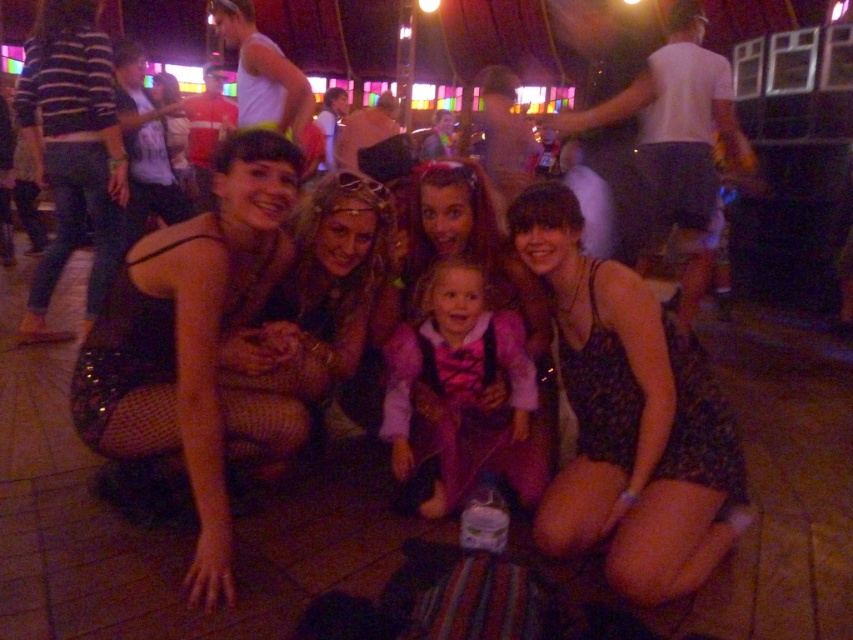
Question: Is matte black dress at center further to the viewer compared to purple velvet dress at center?

Choices:
 (A) yes
 (B) no

Answer: (B)

Question: Which object appears farthest from the camera in this image?

Choices:
 (A) purple velvet dress at center
 (B) matte black dress at center
 (C) black floral dress at center

Answer: (A)

Question: Does black floral dress at center appear on the right side of matte black dress at center?

Choices:
 (A) yes
 (B) no

Answer: (A)

Question: Is matte black dress at center below purple velvet dress at center?

Choices:
 (A) yes
 (B) no

Answer: (B)

Question: Which point is farther from the camera taking this photo?

Choices:
 (A) (560, 525)
 (B) (508, 362)
 (C) (119, 381)

Answer: (B)

Question: Which of the following is the closest to the observer?

Choices:
 (A) matte black dress at center
 (B) purple velvet dress at center

Answer: (A)